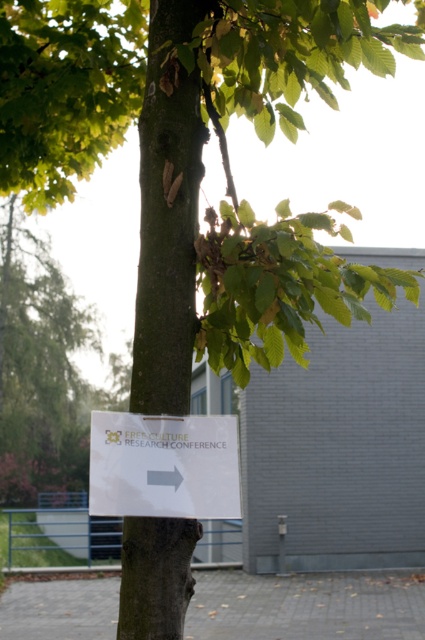
You are a conference attendee holding a map and looking at the image. You need to find the shortest path to the conference venue. Which object should you prioritize stepping on first, the gray concrete pavement at lower center or the white paper sign at center?

The gray concrete pavement at lower center occupies less space than the white paper sign at center, so you should prioritize stepping on the white paper sign at center first since it has more space available for walking.

You are a conference attendee holding a map and standing on the gray concrete pavement at lower center. You see the white paper sign at center pointing towards the FREE CULTURE RESEARCH CONFERENCE. If the sign says the conference is 50 feet away, is the sign accurate?

The distance between the gray concrete pavement at lower center and the white paper sign at center is 35.47 feet, so the sign is not accurate because the actual distance is shorter than stated.

You are standing in front of a tree with a sign attached to its trunk. The sign points to a conference. If you want to touch the smooth brown bark at center, where should you reach relative to the sign?

The smooth brown bark at center is located at point (167, 211) in 2D coordinates, so you should reach towards that position relative to the sign to touch it.